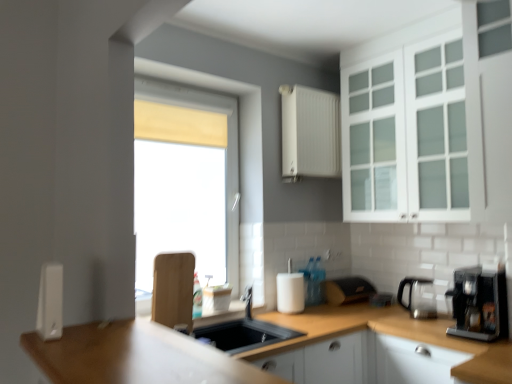
Question: From a real-world perspective, is white matte cabinet at upper center, marked as the 1th cabinetry in a top-to-bottom arrangement, under black plastic coffee machine at right, which ranks as the 1th coffee machine in front-to-back order?

Choices:
 (A) yes
 (B) no

Answer: (B)

Question: Is white matte cabinet at upper center, marked as the 1th cabinetry in a top-to-bottom arrangement, beside black plastic coffee machine at right, placed as the 2th coffee machine when sorted from back to front?

Choices:
 (A) no
 (B) yes

Answer: (A)

Question: From the image's perspective, is white matte cabinet at upper center, which is counted as the third cabinetry, starting from the bottom, beneath black plastic coffee machine at right, which ranks as the 1th coffee machine in front-to-back order?

Choices:
 (A) no
 (B) yes

Answer: (A)

Question: Is white matte cabinet at upper center, marked as the 1th cabinetry in a top-to-bottom arrangement, at the left side of black plastic coffee machine at right, which ranks as the 1th coffee machine in front-to-back order?

Choices:
 (A) no
 (B) yes

Answer: (B)

Question: From a real-world perspective, is white matte cabinet at upper center, which is counted as the third cabinetry, starting from the bottom, located higher than black plastic coffee machine at right, placed as the 2th coffee machine when sorted from back to front?

Choices:
 (A) no
 (B) yes

Answer: (B)

Question: From the image's perspective, is white matte cabinet at upper center, which is counted as the third cabinetry, starting from the bottom, located above black plastic coffee machine at right, which ranks as the 1th coffee machine in front-to-back order?

Choices:
 (A) no
 (B) yes

Answer: (B)

Question: Is white glass cabinet at upper right, the second cabinetry positioned from the bottom, positioned behind satin silver coffee machine at right, acting as the 2th coffee machine starting from the front?

Choices:
 (A) no
 (B) yes

Answer: (A)

Question: Is white glass cabinet at upper right, which appears as the 2th cabinetry when viewed from the top, located outside satin silver coffee machine at right, acting as the 2th coffee machine starting from the front?

Choices:
 (A) no
 (B) yes

Answer: (B)

Question: Is white glass cabinet at upper right, the second cabinetry positioned from the bottom, next to satin silver coffee machine at right, the 1th coffee machine from the back, and touching it?

Choices:
 (A) yes
 (B) no

Answer: (B)

Question: Are white glass cabinet at upper right, the second cabinetry positioned from the bottom, and satin silver coffee machine at right, the 1th coffee machine from the back, far apart?

Choices:
 (A) yes
 (B) no

Answer: (B)

Question: From a real-world perspective, is white glass cabinet at upper right, the second cabinetry positioned from the bottom, over satin silver coffee machine at right, acting as the 2th coffee machine starting from the front?

Choices:
 (A) yes
 (B) no

Answer: (A)

Question: Is white glass cabinet at upper right, which appears as the 2th cabinetry when viewed from the top, facing towards satin silver coffee machine at right, the 1th coffee machine from the back?

Choices:
 (A) no
 (B) yes

Answer: (A)

Question: Can you confirm if satin silver coffee machine at right, acting as the 2th coffee machine starting from the front, is positioned to the right of white matte cabinet at lower right, the 3th cabinetry from the top?

Choices:
 (A) no
 (B) yes

Answer: (B)